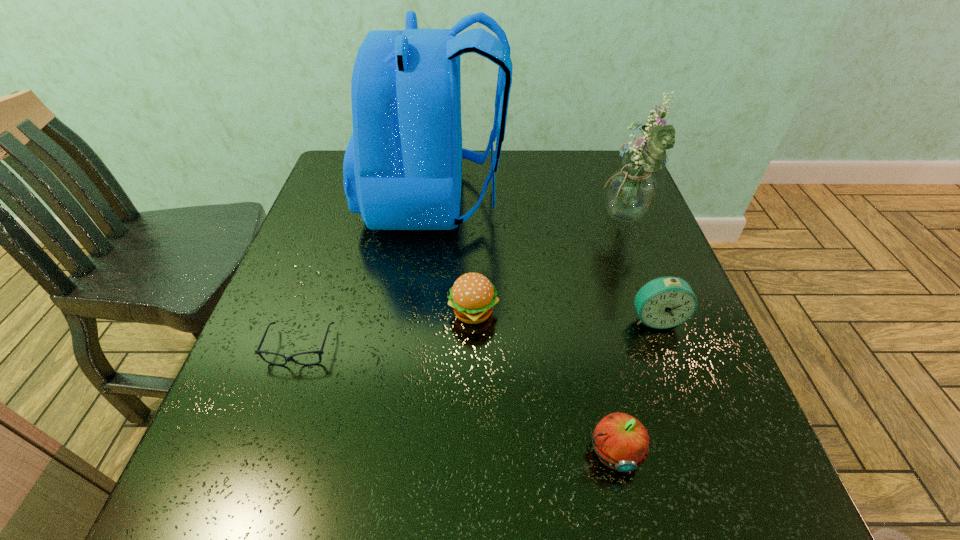
Where is `vacant point located on the front-facing side of the bouquet`? The image size is (960, 540). vacant point located on the front-facing side of the bouquet is located at coordinates (523, 221).

What are the coordinates of `vacant space situated 0.140m on the front-facing side of the alarm clock` in the screenshot? It's located at (684, 395).

Image resolution: width=960 pixels, height=540 pixels. Find the location of `free location located on the right of the nearest object`. free location located on the right of the nearest object is located at coordinates (730, 452).

At what (x,y) coordinates should I click in order to perform the action: click on blank space located 0.370m on the left of the hamburger. Please return your answer as a coordinate pair (x, y). The width and height of the screenshot is (960, 540). Looking at the image, I should click on (267, 313).

Where is `free space located on the front-facing side of the spectacles`? free space located on the front-facing side of the spectacles is located at coordinates (252, 483).

At what (x,y) coordinates should I click in order to perform the action: click on object that is at the far edge. Please return your answer as a coordinate pair (x, y). Looking at the image, I should click on (402, 168).

Identify the location of object located at the near edge. Image resolution: width=960 pixels, height=540 pixels. (621, 442).

This screenshot has width=960, height=540. Identify the location of backpack positioned at the left edge. (402, 168).

Find the location of `spectacles present at the left edge`. spectacles present at the left edge is located at coordinates (287, 359).

At what (x,y) coordinates should I click in order to perform the action: click on bouquet that is at the right edge. Please return your answer as a coordinate pair (x, y). Image resolution: width=960 pixels, height=540 pixels. Looking at the image, I should click on coord(630,191).